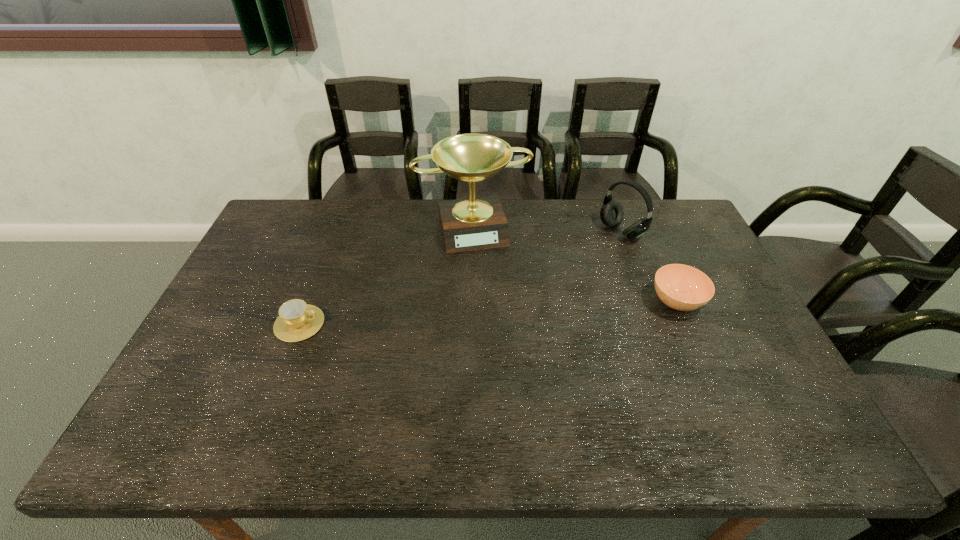
Locate an element on the screen. The height and width of the screenshot is (540, 960). vacant space at the right edge of the desktop is located at coordinates (719, 346).

The width and height of the screenshot is (960, 540). I want to click on free space at the far right corner of the desktop, so click(x=655, y=231).

Image resolution: width=960 pixels, height=540 pixels. Identify the location of unoccupied area between the soup bowl and the headset. (649, 266).

Identify the location of blank region between the headset and the award. (547, 230).

This screenshot has width=960, height=540. Find the location of `free point between the soup bowl and the third object from right to left`. free point between the soup bowl and the third object from right to left is located at coordinates (575, 265).

Find the location of a particular element. empty space between the leftmost object and the tallest object is located at coordinates (386, 275).

The width and height of the screenshot is (960, 540). I want to click on vacant area between the award and the headset, so 547,230.

At what (x,y) coordinates should I click in order to perform the action: click on free space between the tallest object and the soup bowl. Please return your answer as a coordinate pair (x, y). The height and width of the screenshot is (540, 960). Looking at the image, I should click on (575, 265).

Locate an element on the screen. The image size is (960, 540). vacant area that lies between the cup and the tallest object is located at coordinates click(x=386, y=275).

The height and width of the screenshot is (540, 960). Find the location of `unoccupied position between the shortest object and the headset`. unoccupied position between the shortest object and the headset is located at coordinates (461, 278).